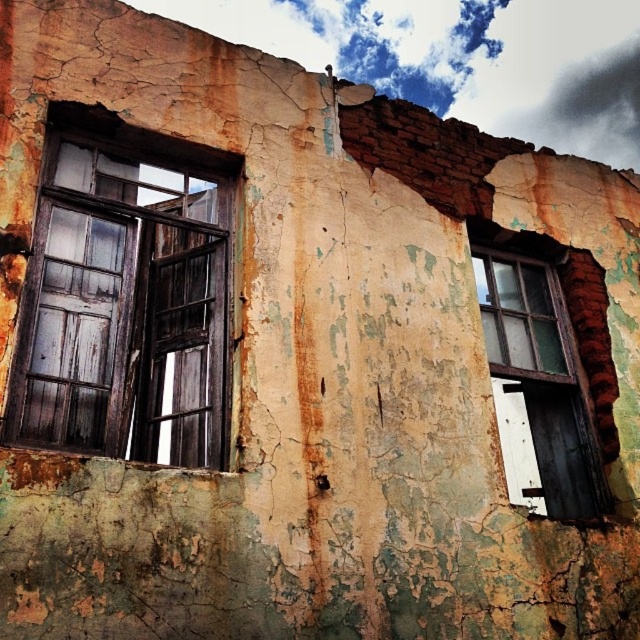
Is wooden window at left to the right of wooden window at right from the viewer's perspective?

Incorrect, wooden window at left is not on the right side of wooden window at right.

Is wooden window at left further to camera compared to wooden window at right?

No.

Find the location of a particular element. This screenshot has height=640, width=640. wooden window at left is located at coordinates (124, 296).

Image resolution: width=640 pixels, height=640 pixels. I want to click on wooden window at left, so click(x=124, y=296).